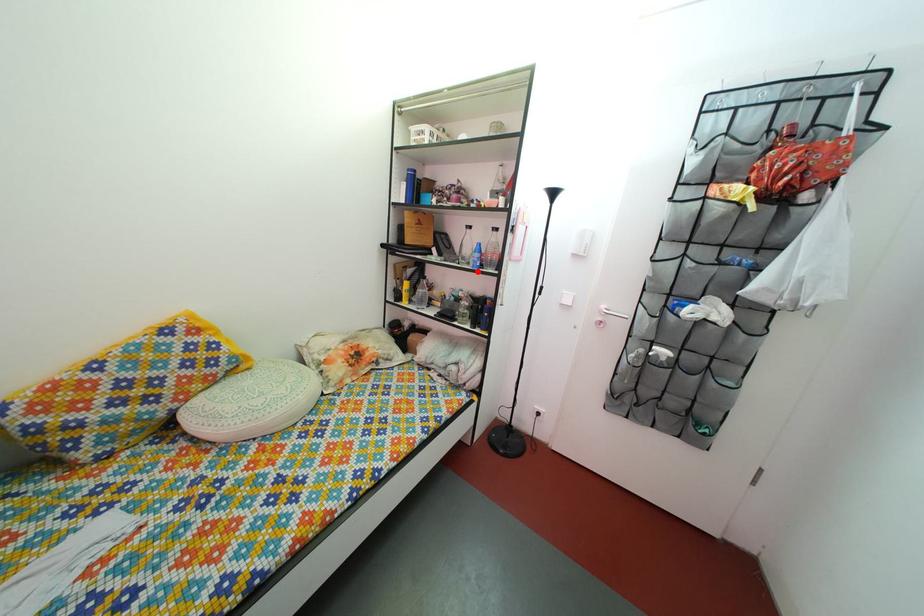
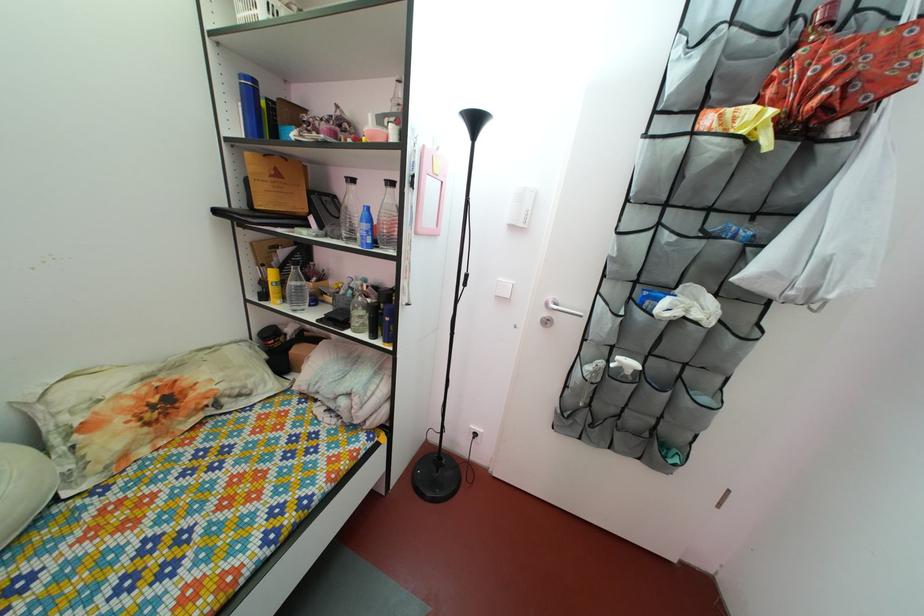
Where in the second image is the point corresponding to the highlighted location from the first image?

(363, 248)